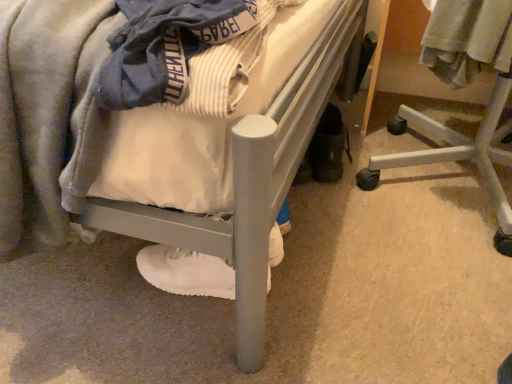
Describe the element at coordinates (157, 142) in the screenshot. I see `matte gray bed at center` at that location.

I want to click on matte gray bed at center, so click(x=157, y=142).

Measure the distance between point (152, 260) and camera.

Point (152, 260) and camera are 34.80 inches apart from each other.

At what (x,y) coordinates should I click in order to perform the action: click on light gray cotton shirt at upper right. Please return your answer as a coordinate pair (x, y). This screenshot has height=384, width=512. Looking at the image, I should click on (467, 39).

From a real-world perspective, which object rests below the other?

matte gray bed at center, from a real-world perspective.

Which object is thinner, light gray cotton shirt at upper right or matte gray bed at center?

light gray cotton shirt at upper right is thinner.

Between light gray cotton shirt at upper right and matte gray bed at center, which one has smaller size?

With smaller size is light gray cotton shirt at upper right.

Is white plastic chair at lower right completely or partially outside of matte gray bed at center?

Indeed, white plastic chair at lower right is completely outside matte gray bed at center.

Between white plastic chair at lower right and matte gray bed at center, which one has less height?

Standing shorter between the two is white plastic chair at lower right.

Based on the photo, from a real-world perspective, relative to matte gray bed at center, is white plastic chair at lower right vertically above or below?

Clearly, from a real-world perspective, white plastic chair at lower right is below matte gray bed at center.

Find the location of a particular element. furniture located below the matte gray bed at center (from the image's perspective) is located at coordinates (457, 154).

Is light gray cotton shirt at upper right further to camera compared to white plastic chair at lower right?

Yes, it is behind white plastic chair at lower right.

From a real-world perspective, who is located higher, light gray cotton shirt at upper right or white plastic chair at lower right?

light gray cotton shirt at upper right, from a real-world perspective.

In the scene shown: Which is closer to the camera, (506, 31) or (502, 219)?

Point (506, 31) is closer to the camera than point (502, 219).

Consider the image. Would you say light gray cotton shirt at upper right is a long distance from white plastic chair at lower right?

That's not correct — light gray cotton shirt at upper right is a little close to white plastic chair at lower right.

What's the angular difference between matte gray bed at center and light gray cotton shirt at upper right's facing directions?

49.2 degrees.

Looking at this image, from the image's perspective, which is above, matte gray bed at center or light gray cotton shirt at upper right?

matte gray bed at center appears higher in the image.

Is matte gray bed at center inside the boundaries of light gray cotton shirt at upper right, or outside?

matte gray bed at center exists outside the volume of light gray cotton shirt at upper right.

Can you confirm if matte gray bed at center is smaller than light gray cotton shirt at upper right?

Incorrect, matte gray bed at center is not smaller in size than light gray cotton shirt at upper right.

Between white plastic chair at lower right and light gray cotton shirt at upper right, which one appears on the right side from the viewer's perspective?

From the viewer's perspective, white plastic chair at lower right appears more on the right side.

From their relative heights in the image, would you say white plastic chair at lower right is taller or shorter than light gray cotton shirt at upper right?

white plastic chair at lower right is taller than light gray cotton shirt at upper right.

Which object is closer to the camera taking this photo, white plastic chair at lower right or light gray cotton shirt at upper right?

Positioned in front is white plastic chair at lower right.

Which is less distant, (x=482, y=139) or (x=452, y=66)?

The point (x=452, y=66) is closer.

Is matte gray bed at center positioned far away from white matte sneaker at lower center?

That's not correct — matte gray bed at center is a little close to white matte sneaker at lower center.

Which of these two, matte gray bed at center or white matte sneaker at lower center, is bigger?

matte gray bed at center is bigger.

Is matte gray bed at center not within white matte sneaker at lower center?

matte gray bed at center is positioned outside white matte sneaker at lower center.

Image resolution: width=512 pixels, height=384 pixels. I want to click on bed that is in front of the white matte sneaker at lower center, so point(157,142).

Is point (250, 133) in front of point (494, 94)?

Yes, it is.

Is matte gray bed at center not close to white plastic chair at lower right?

No, matte gray bed at center is not far away from white plastic chair at lower right.

From the image's perspective, is matte gray bed at center positioned above or below white plastic chair at lower right?

From the image's perspective, matte gray bed at center appears above white plastic chair at lower right.

You are a GUI agent. You are given a task and a screenshot of the screen. Output one action in this format:
    pyautogui.click(x=<x>, y=<y>)
    Task: Click on the bed that is on the left side of white plastic chair at lower right
    The height and width of the screenshot is (384, 512).
    Given the screenshot: What is the action you would take?
    pyautogui.click(x=157, y=142)

You are a GUI agent. You are given a task and a screenshot of the screen. Output one action in this format:
    pyautogui.click(x=<x>, y=<y>)
    Task: Click on the clothing on the right of the matte gray bed at center
    This screenshot has width=512, height=384.
    Given the screenshot: What is the action you would take?
    pyautogui.click(x=467, y=39)

You are a GUI agent. You are given a task and a screenshot of the screen. Output one action in this format:
    pyautogui.click(x=<x>, y=<y>)
    Task: Click on the furniture that appears behind the matte gray bed at center
    The width and height of the screenshot is (512, 384).
    Given the screenshot: What is the action you would take?
    pyautogui.click(x=457, y=154)

Which object lies further to the anchor point matte gray bed at center, light gray cotton shirt at upper right or white plastic chair at lower right?

Among the two, white plastic chair at lower right is located further to matte gray bed at center.

Looking at the image, which one is located further to light gray cotton shirt at upper right, white plastic chair at lower right or matte gray bed at center?

matte gray bed at center.

Estimate the real-world distances between objects in this image. Which object is closer to matte gray bed at center, white matte sneaker at lower center or white plastic chair at lower right?

Among the two, white matte sneaker at lower center is located nearer to matte gray bed at center.

From the image, which object appears to be nearer to white matte sneaker at lower center, matte gray bed at center or white plastic chair at lower right?

matte gray bed at center is positioned closer to the anchor white matte sneaker at lower center.

Estimate the real-world distances between objects in this image. Which object is closer to matte gray bed at center, white matte sneaker at lower center or light gray cotton shirt at upper right?

white matte sneaker at lower center is closer to matte gray bed at center.

Consider the image. When comparing their distances from white matte sneaker at lower center, does light gray cotton shirt at upper right or white plastic chair at lower right seem further?

light gray cotton shirt at upper right is positioned further to the anchor white matte sneaker at lower center.

Based on their spatial positions, is light gray cotton shirt at upper right or white matte sneaker at lower center further from matte gray bed at center?

light gray cotton shirt at upper right is further to matte gray bed at center.

Estimate the real-world distances between objects in this image. Which object is further from white plastic chair at lower right, white matte sneaker at lower center or matte gray bed at center?

matte gray bed at center is further to white plastic chair at lower right.

Locate an element on the screen. Image resolution: width=512 pixels, height=384 pixels. footwear between matte gray bed at center and white plastic chair at lower right in the horizontal direction is located at coordinates (186, 272).

You are a GUI agent. You are given a task and a screenshot of the screen. Output one action in this format:
    pyautogui.click(x=<x>, y=<y>)
    Task: Click on the clothing between white matte sneaker at lower center and white plastic chair at lower right
    The width and height of the screenshot is (512, 384).
    Given the screenshot: What is the action you would take?
    pyautogui.click(x=467, y=39)

Locate an element on the screen. footwear situated between matte gray bed at center and light gray cotton shirt at upper right from left to right is located at coordinates (186, 272).

This screenshot has height=384, width=512. I want to click on clothing located between matte gray bed at center and white plastic chair at lower right in the left-right direction, so click(467, 39).